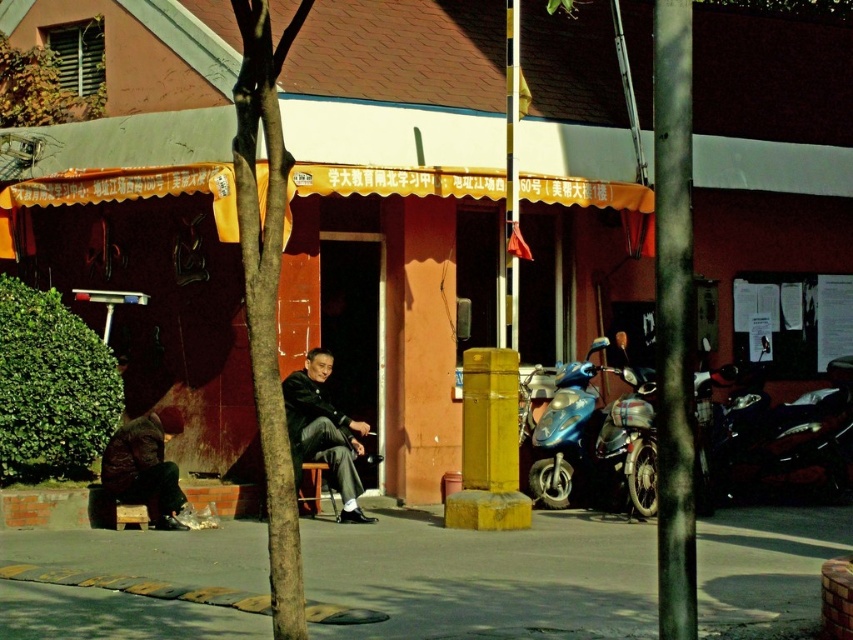
Does smooth brown tree trunk at center-left appear over dark gray fabric jacket at center?

Correct, smooth brown tree trunk at center-left is located above dark gray fabric jacket at center.

Which is in front, point (270, 138) or point (287, 428)?

Positioned in front is point (270, 138).

Which is in front, point (299, 560) or point (334, 474)?

Point (299, 560) is more forward.

Locate an element on the screen. The height and width of the screenshot is (640, 853). smooth brown tree trunk at center-left is located at coordinates (267, 291).

Between smooth brown tree trunk at center-left and brown leather jacket at lower left, which one has less height?

brown leather jacket at lower left is shorter.

Which is more to the left, smooth brown tree trunk at center-left or brown leather jacket at lower left?

From the viewer's perspective, brown leather jacket at lower left appears more on the left side.

Which is behind, point (238, 26) or point (158, 461)?

The point (158, 461) is behind.

Image resolution: width=853 pixels, height=640 pixels. I want to click on smooth brown tree trunk at center-left, so (x=267, y=291).

Based on the photo, which is above, smooth asphalt at center or blue metallic motorcycle at lower right?

Positioned higher is blue metallic motorcycle at lower right.

Is smooth asphalt at center taller than blue metallic motorcycle at lower right?

Incorrect, smooth asphalt at center's height is not larger of blue metallic motorcycle at lower right's.

Who is more forward, (236, 548) or (612, 497)?

Point (236, 548)

Find the location of a particular element. This screenshot has height=640, width=853. smooth asphalt at center is located at coordinates (485, 576).